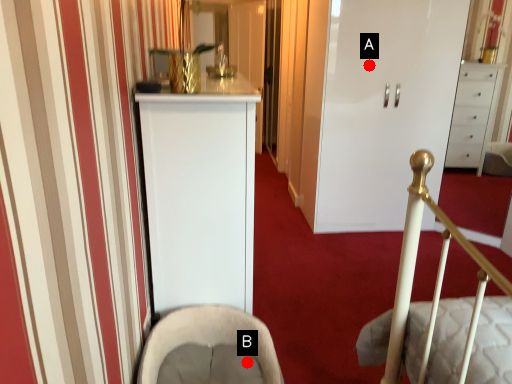
Question: Two points are circled on the image, labeled by A and B beside each circle. Which point is closer to the camera?

Choices:
 (A) A is closer
 (B) B is closer

Answer: (B)